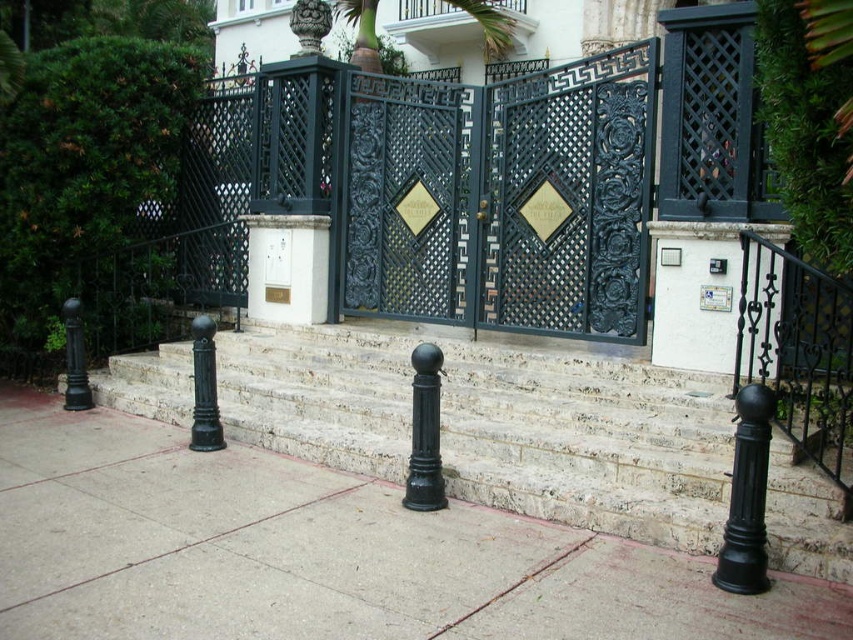
You are a delivery person approaching the entrance. You need to bring a large box that is 2 meters wide. The box must be carried through either the white marble stairs at center or the dark blue wrought iron gate at center. Based on their widths, which path should you choose to ensure the box fits through?

The white marble stairs at center has a larger width than the dark blue wrought iron gate at center. Therefore, you should choose the white marble stairs at center to carry the large box through since it can accommodate the 2 meter width.

You are standing at point A, which is located at the coordinates [405,198]. What object is located at your current position?

The dark blue wrought iron gate at center is located at point A, which is at coordinates [405,198].

You are a delivery person approaching the entrance. You need to deliver a package to the property. The gate is closed, but you notice the dark blue wrought iron gate at center and the black wrought iron railing at right. Which object should you approach to find the intercom or buzzer?

The dark blue wrought iron gate at center is to the left of the black wrought iron railing at right. Since the gate is closed, the intercom or buzzer is likely located on the dark blue wrought iron gate at center, which is the main entrance point.